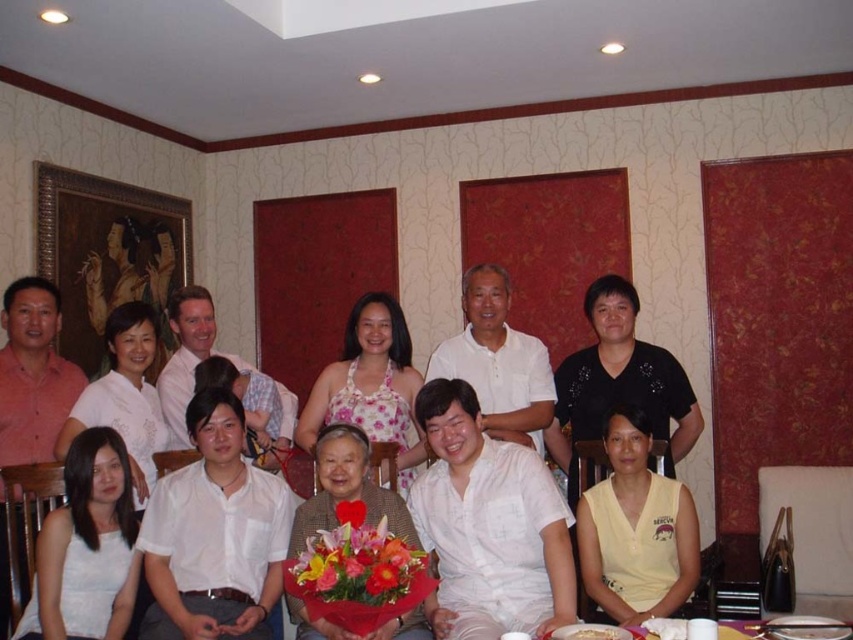
Is yellow cotton blouse at lower center positioned before floral print dress at center?

Yes, it is.

Which is behind, point (618, 481) or point (366, 339)?

The point (366, 339) is behind.

Measure the distance between yellow cotton blouse at lower center and camera.

A distance of 2.46 meters exists between yellow cotton blouse at lower center and camera.

Where is `yellow cotton blouse at lower center`? This screenshot has height=640, width=853. yellow cotton blouse at lower center is located at coordinates (636, 531).

Who is shorter, yellow cotton blouse at lower center or white satin dress at lower left?

white satin dress at lower left is shorter.

Locate an element on the screen. yellow cotton blouse at lower center is located at coordinates (636, 531).

Where is `yellow cotton blouse at lower center`? The image size is (853, 640). yellow cotton blouse at lower center is located at coordinates (636, 531).

Can you confirm if white satin blouse at center is taller than white paper plate at lower center?

Yes.

Is point (107, 372) farther from viewer compared to point (624, 634)?

Yes.

The height and width of the screenshot is (640, 853). Describe the element at coordinates (125, 396) in the screenshot. I see `white satin blouse at center` at that location.

Where is `white satin blouse at center`? The height and width of the screenshot is (640, 853). white satin blouse at center is located at coordinates (125, 396).